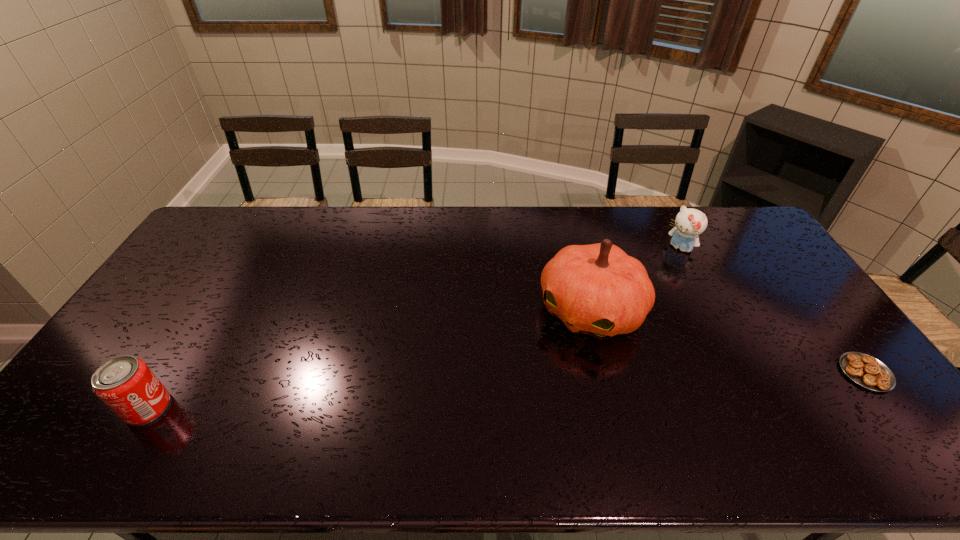
Identify the location of can. (125, 384).

The height and width of the screenshot is (540, 960). I want to click on pastry, so click(867, 371).

Locate an element on the screen. The image size is (960, 540). the shortest object is located at coordinates (867, 371).

This screenshot has width=960, height=540. What are the coordinates of `the third object from left to right` in the screenshot? It's located at (690, 223).

Identify the location of kitten. click(690, 223).

Where is `the third nearest object`? Image resolution: width=960 pixels, height=540 pixels. the third nearest object is located at coordinates (597, 289).

The height and width of the screenshot is (540, 960). What are the coordinates of `the third object from right to left` in the screenshot? It's located at (597, 289).

Locate an element on the screen. This screenshot has width=960, height=540. free space located on the right of the leftmost object is located at coordinates (222, 408).

The width and height of the screenshot is (960, 540). I want to click on free spot located 0.350m on the back of the pastry, so click(787, 269).

This screenshot has height=540, width=960. I want to click on vacant area situated on the front-facing side of the kitten, so click(665, 263).